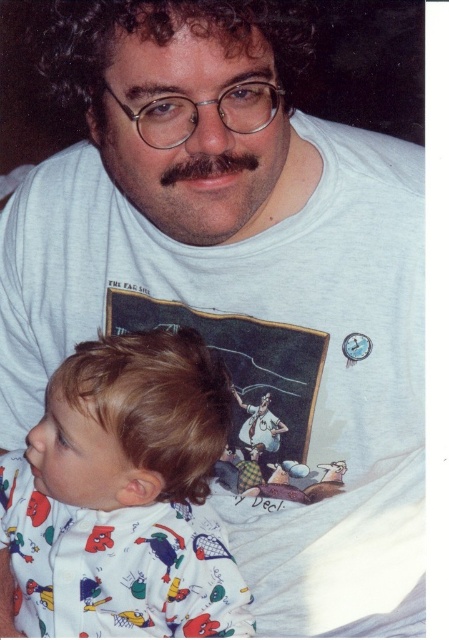
In the scene shown: Is white cotton onesie at lower left below dark brown hair at center?

Correct, white cotton onesie at lower left is located below dark brown hair at center.

Is white cotton onesie at lower left to the right of dark brown hair at center from the viewer's perspective?

In fact, white cotton onesie at lower left is to the left of dark brown hair at center.

Between point (233, 588) and point (207, 118), which one is positioned behind?

The point (233, 588) is more distant.

The height and width of the screenshot is (640, 449). Identify the location of white cotton onesie at lower left. (122, 499).